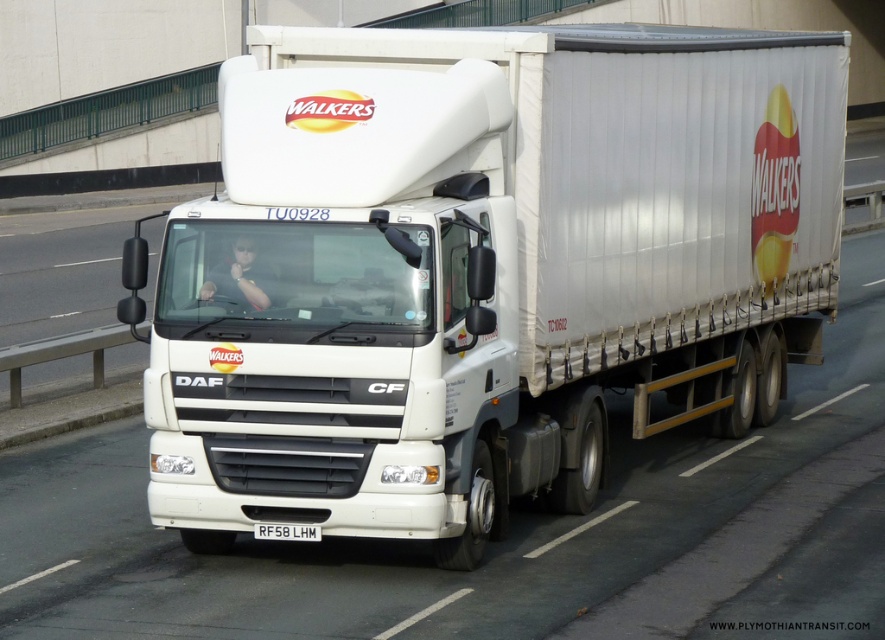
Is white matte truck at center bigger than matte black shirt at center?

Yes, white matte truck at center is bigger than matte black shirt at center.

Between white matte truck at center and matte black shirt at center, which one appears on the left side from the viewer's perspective?

Positioned to the left is matte black shirt at center.

At what (x,y) coordinates should I click in order to perform the action: click on white matte truck at center. Please return your answer as a coordinate pair (x, y). Looking at the image, I should click on (487, 268).

Identify the location of white matte truck at center. The height and width of the screenshot is (640, 885). (487, 268).

Who is positioned more to the left, white matte truck at center or white plastic license plate at center?

From the viewer's perspective, white plastic license plate at center appears more on the left side.

Does white matte truck at center appear over white plastic license plate at center?

Yes.

Who is more distant from viewer, (x=601, y=221) or (x=268, y=528)?

Positioned behind is point (x=601, y=221).

The height and width of the screenshot is (640, 885). Find the location of `white matte truck at center`. white matte truck at center is located at coordinates (487, 268).

Does matte black shirt at center appear under white plastic license plate at center?

No, matte black shirt at center is not below white plastic license plate at center.

Is matte black shirt at center bigger than white plastic license plate at center?

Yes, matte black shirt at center is bigger than white plastic license plate at center.

Describe the element at coordinates (241, 278) in the screenshot. The image size is (885, 640). I see `matte black shirt at center` at that location.

Where is `matte black shirt at center`? This screenshot has height=640, width=885. matte black shirt at center is located at coordinates (241, 278).